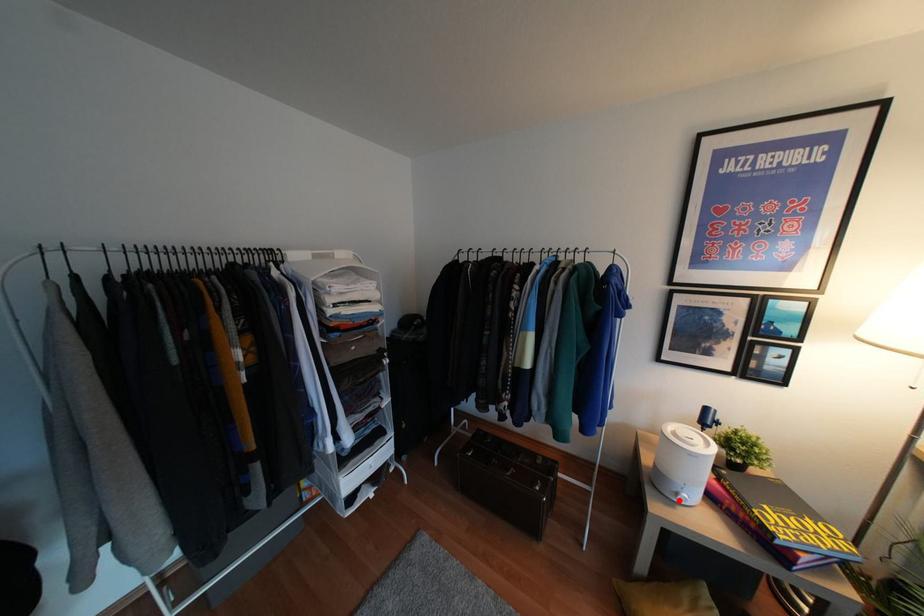
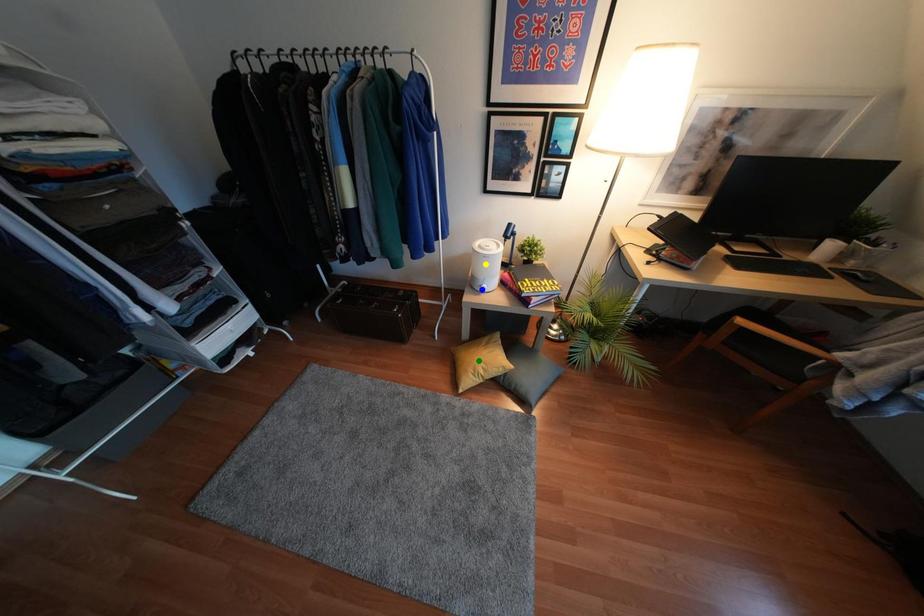
Question: I am providing you with two images of the same scene from different viewpoints. A red point is marked on the first image. You are given multiple points on the second image. Which spot in image 2 lines up with the point in image 1?

Choices:
 (A) blue point
 (B) green point
 (C) yellow point

Answer: (A)